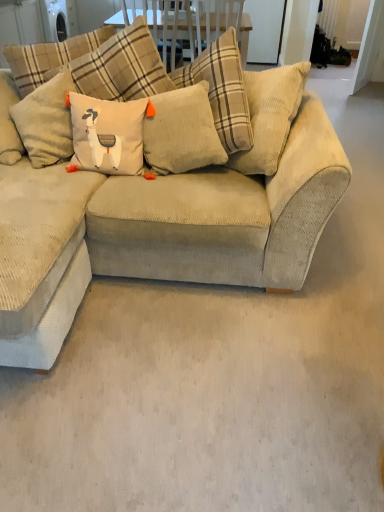
Question: Based on their positions, is beige corduroy couch at center located to the left or right of corduroy pillow at center?

Choices:
 (A) right
 (B) left

Answer: (B)

Question: Does point (163, 231) appear closer or farther from the camera than point (196, 143)?

Choices:
 (A) closer
 (B) farther

Answer: (A)

Question: From the image's perspective, is beige corduroy couch at center located above or below corduroy pillow at center?

Choices:
 (A) below
 (B) above

Answer: (A)

Question: In the image, is corduroy pillow at center positioned in front of or behind beige corduroy couch at center?

Choices:
 (A) front
 (B) behind

Answer: (B)

Question: Considering the positions of corduroy pillow at center and beige corduroy couch at center in the image, is corduroy pillow at center wider or thinner than beige corduroy couch at center?

Choices:
 (A) wide
 (B) thin

Answer: (B)

Question: Visually, is corduroy pillow at center positioned to the left or to the right of beige corduroy couch at center?

Choices:
 (A) left
 (B) right

Answer: (B)

Question: From a real-world perspective, is corduroy pillow at center above or below beige corduroy couch at center?

Choices:
 (A) below
 (B) above

Answer: (B)